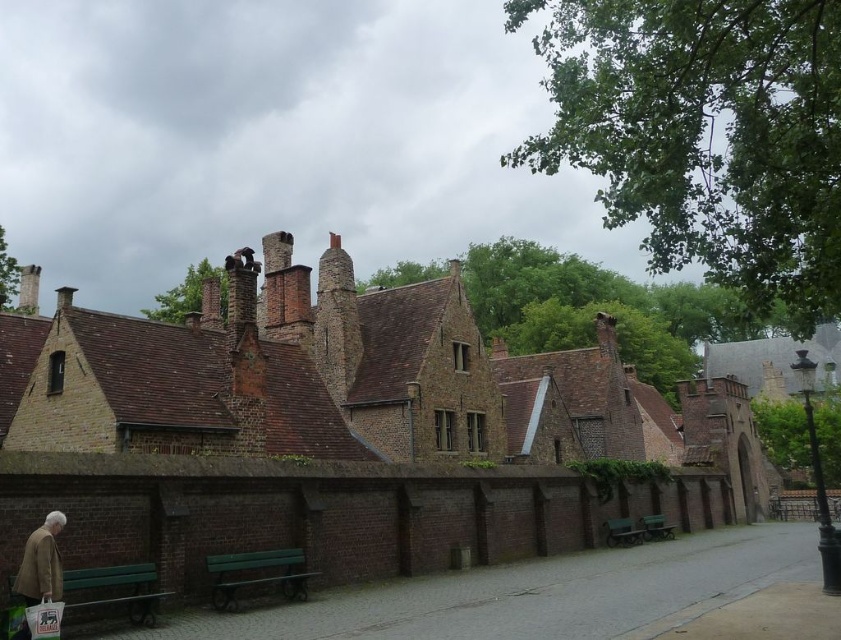
Which is below, green wooden bench at lower left or light brown leather jacket at lower left?

green wooden bench at lower left is lower down.

Between point (140, 621) and point (56, 573), which one is positioned in front?

Positioned in front is point (56, 573).

At what (x,y) coordinates should I click in order to perform the action: click on green wooden bench at lower left. Please return your answer as a coordinate pair (x, y). Looking at the image, I should click on (115, 589).

The width and height of the screenshot is (841, 640). What do you see at coordinates (41, 563) in the screenshot? I see `light brown leather jacket at lower left` at bounding box center [41, 563].

Who is more distant from viewer, (29, 579) or (622, 524)?

The point (622, 524) is behind.

Locate an element on the screen. The height and width of the screenshot is (640, 841). light brown leather jacket at lower left is located at coordinates (41, 563).

Is green wooden bench at lower left thinner than green wooden bench at lower center?

Yes.

Does green wooden bench at lower left have a smaller size compared to green wooden bench at lower center?

Yes.

Where is `green wooden bench at lower left`? This screenshot has height=640, width=841. green wooden bench at lower left is located at coordinates (115, 589).

Image resolution: width=841 pixels, height=640 pixels. What are the coordinates of `green wooden bench at lower left` in the screenshot? It's located at tap(115, 589).